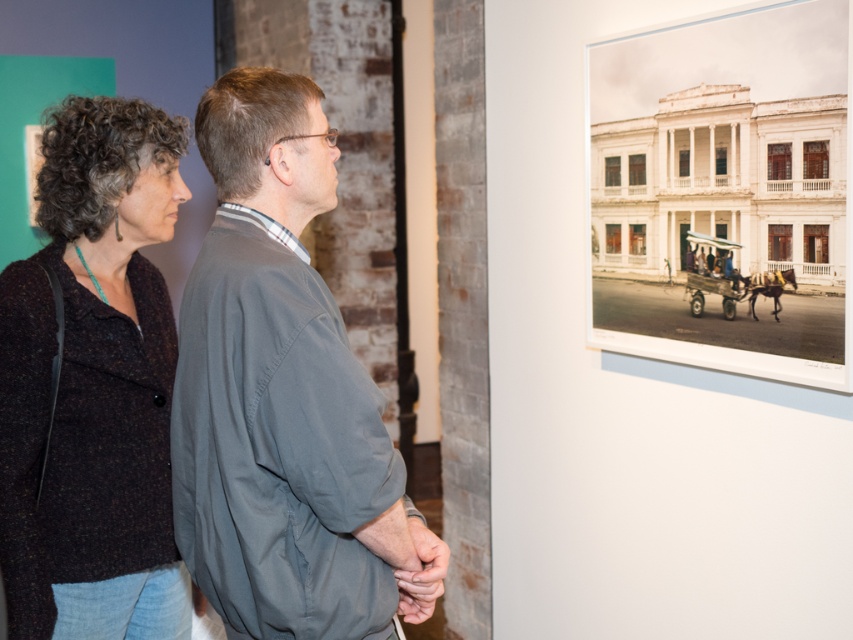
Question: Which point is farther to the camera?

Choices:
 (A) dark speckled fabric at upper left
 (B) gray fabric shirt at center

Answer: (A)

Question: Is gray fabric shirt at center further to camera compared to dark speckled fabric at upper left?

Choices:
 (A) yes
 (B) no

Answer: (B)

Question: Is gray fabric shirt at center bigger than dark speckled fabric at upper left?

Choices:
 (A) no
 (B) yes

Answer: (A)

Question: Does gray fabric shirt at center have a larger size compared to dark speckled fabric at upper left?

Choices:
 (A) yes
 (B) no

Answer: (B)